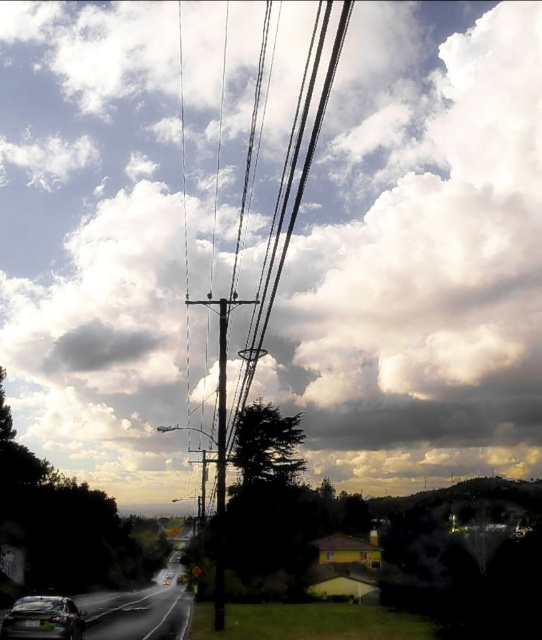
Question: Does smooth metallic pole at center have a lesser width compared to shiny black sedan at lower left?

Choices:
 (A) yes
 (B) no

Answer: (A)

Question: Which point is farther to the camera?

Choices:
 (A) (22, 627)
 (B) (221, 420)

Answer: (B)

Question: Is smooth metallic pole at center bigger than shiny black sedan at lower left?

Choices:
 (A) yes
 (B) no

Answer: (A)

Question: Can you confirm if smooth metallic pole at center is wider than shiny black sedan at lower left?

Choices:
 (A) no
 (B) yes

Answer: (A)